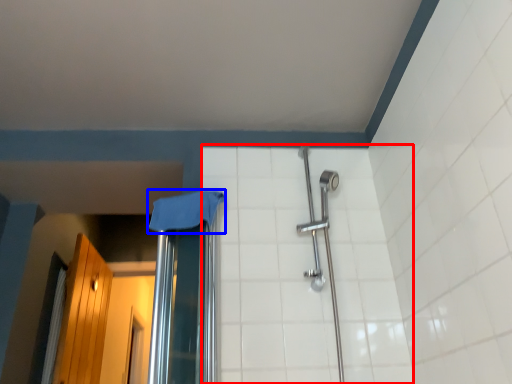
Question: Which point is further to the camera, ceramic tile (highlighted by a red box) or cloth (highlighted by a blue box)?

Choices:
 (A) ceramic tile
 (B) cloth

Answer: (B)